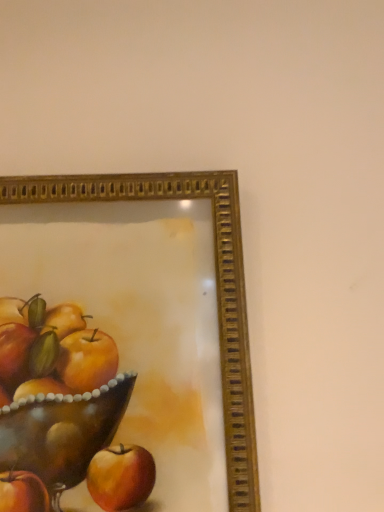
The height and width of the screenshot is (512, 384). What do you see at coordinates (216, 283) in the screenshot? I see `gold textured frame at upper left` at bounding box center [216, 283].

This screenshot has width=384, height=512. What are the coordinates of `gold textured frame at upper left` in the screenshot? It's located at (216, 283).

At what (x,y) coordinates should I click in order to perform the action: click on gold textured frame at upper left. Please return your answer as a coordinate pair (x, y). The height and width of the screenshot is (512, 384). Looking at the image, I should click on (216, 283).